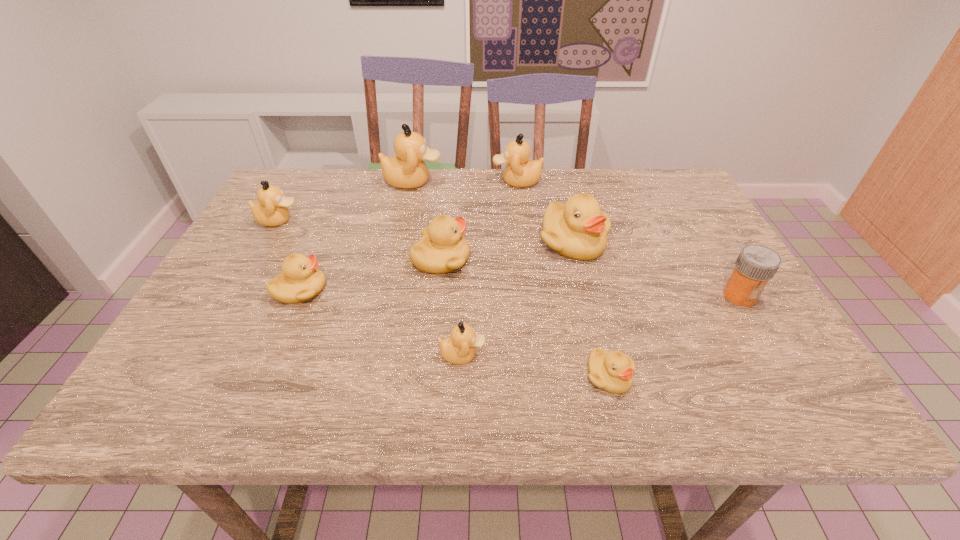
You are a GUI agent. You are given a task and a screenshot of the screen. Output one action in this format:
    pyautogui.click(x=<x>, y=<y>)
    Task: Click on the vacant area located 0.060m on the face of the second smallest tan duckling
    Image resolution: width=960 pixels, height=540 pixels.
    Given the screenshot: What is the action you would take?
    pos(323,220)

Find the location of a particular element. vacant area located on the front-facing side of the second biggest yellow duckling is located at coordinates (545, 259).

Locate an element on the screen. vacant space located 0.240m on the label side of the orange medicine is located at coordinates tap(807, 408).

Image resolution: width=960 pixels, height=540 pixels. In order to click on vacant space situated on the front-facing side of the second object from left to right in this screenshot , I will do pyautogui.click(x=468, y=290).

What are the coordinates of `vacant space situated 0.320m on the face of the smallest tan duckling` in the screenshot? It's located at (650, 355).

Where is `object positioned at the near edge`? This screenshot has height=540, width=960. object positioned at the near edge is located at coordinates (612, 371).

Identify the location of object that is at the right edge. (756, 264).

The width and height of the screenshot is (960, 540). Find the location of `object present at the far left corner`. object present at the far left corner is located at coordinates (271, 209).

The image size is (960, 540). Find the location of `free location at the far edge of the desktop`. free location at the far edge of the desktop is located at coordinates (410, 193).

Where is `free space at the near edge of the desktop`? The image size is (960, 540). free space at the near edge of the desktop is located at coordinates (400, 404).